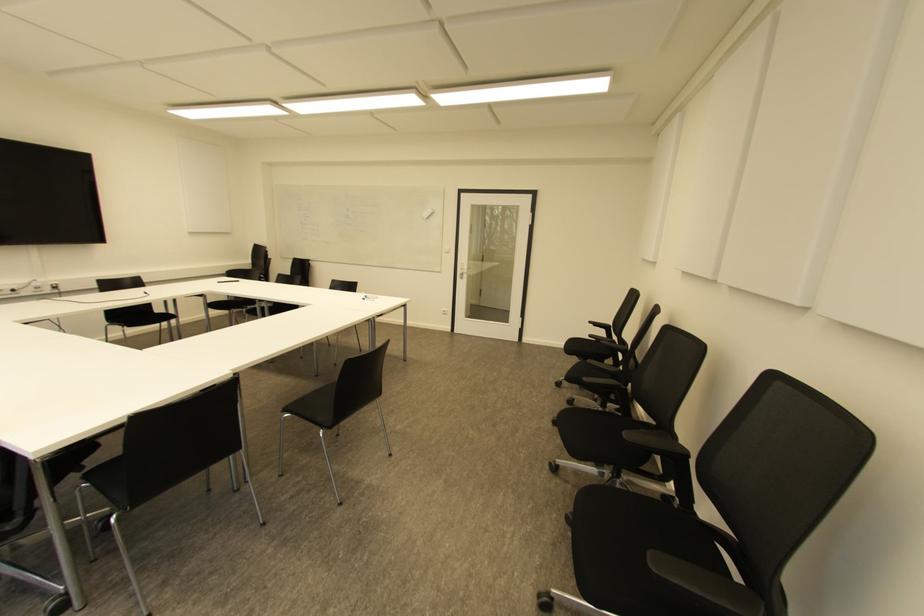
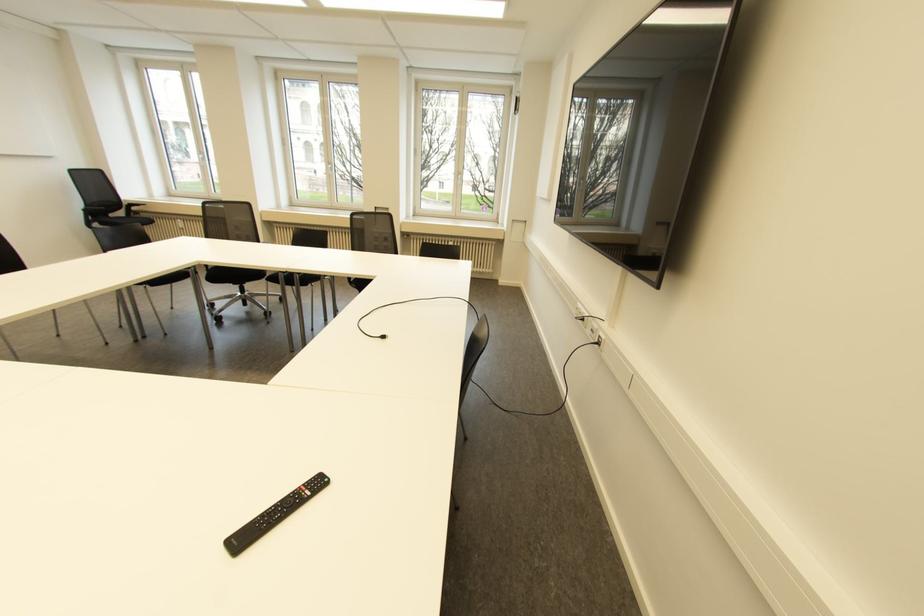
The point at [55,286] is marked in the first image. Where is the corresponding point in the second image?

(598, 342)